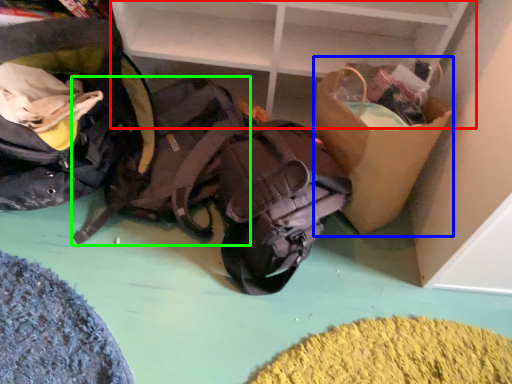
Question: Considering the real-world distances, which object is farthest from shelf (highlighted by a red box)? cardboard box (highlighted by a blue box) or backpack (highlighted by a green box)?

Choices:
 (A) cardboard box
 (B) backpack

Answer: (B)